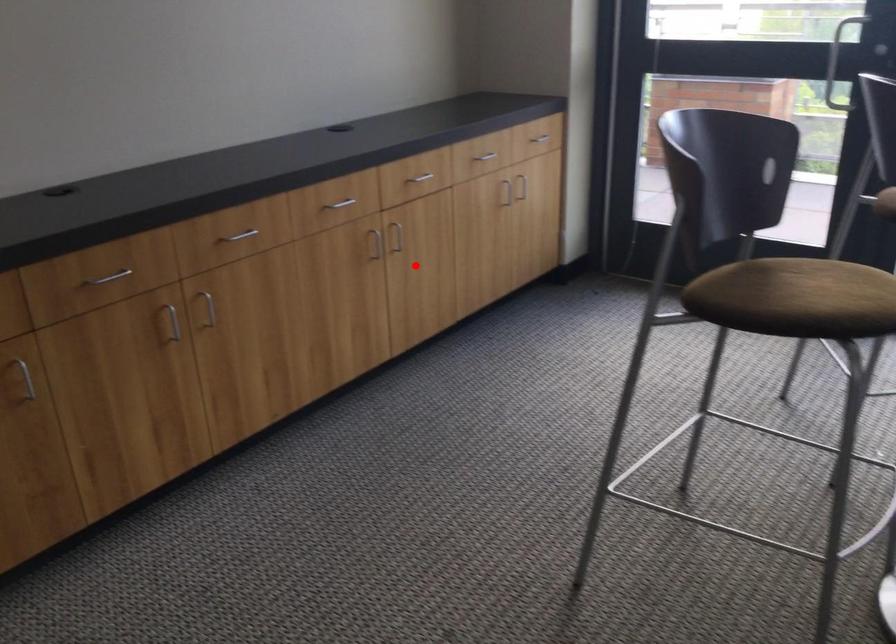
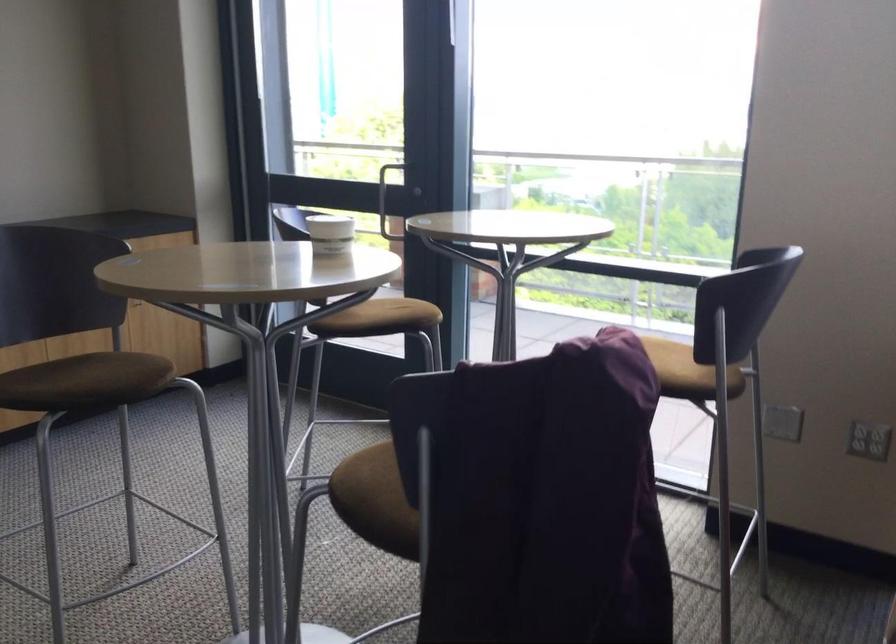
Question: I am providing you with two images of the same scene from different viewpoints. In image1, a red point is highlighted. Considering the same 3D point in image2, which of the following is correct?

Choices:
 (A) It is closer
 (B) It is farther

Answer: (B)